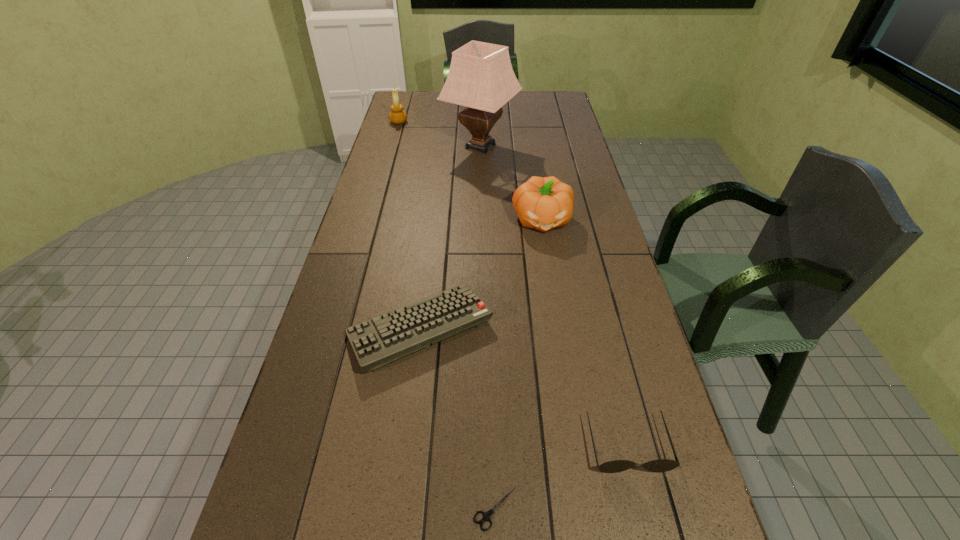
This screenshot has width=960, height=540. I want to click on vacant space that's between the second nearest object and the shortest object, so (562, 476).

Image resolution: width=960 pixels, height=540 pixels. In order to click on object identified as the fourth closest to the fifth nearest object in this screenshot , I will do `click(662, 465)`.

Image resolution: width=960 pixels, height=540 pixels. Identify the location of object that is the fifth closest to the sunglasses. (397, 116).

You are a GUI agent. You are given a task and a screenshot of the screen. Output one action in this format:
    pyautogui.click(x=<x>, y=<y>)
    Task: Click on the vacant space that satisfies the following two spatial constraints: 1. on the front side of the nearest object; 2. on the right side of the lampshade
    
    Given the screenshot: What is the action you would take?
    pyautogui.click(x=481, y=508)

The image size is (960, 540). Identify the location of free region that satisfies the following two spatial constraints: 1. on the front side of the computer keyboard; 2. on the left side of the farthest object. (341, 328).

The height and width of the screenshot is (540, 960). I want to click on free point that satisfies the following two spatial constraints: 1. on the front side of the shears; 2. on the left side of the fifth nearest object, so click(x=481, y=508).